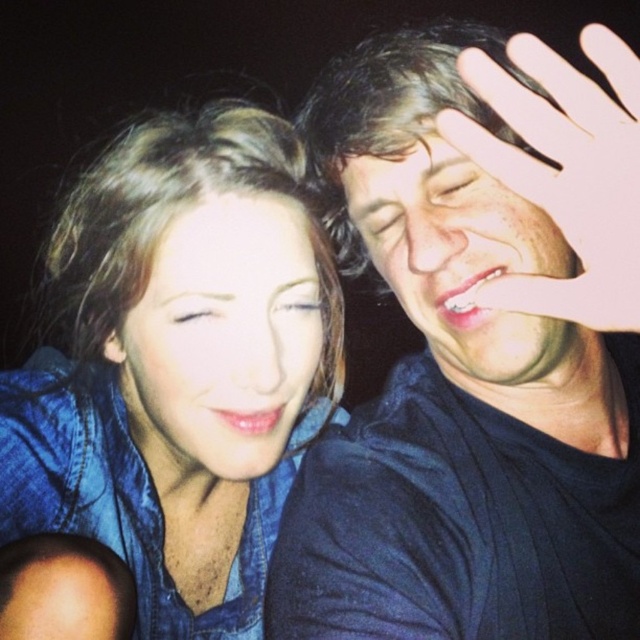
Locate an element on the screen. This screenshot has width=640, height=640. matte black shirt at right is located at coordinates (481, 355).

Is point (525, 54) in front of point (282, 308)?

Yes, point (525, 54) is closer to viewer.

Describe the element at coordinates (481, 355) in the screenshot. I see `matte black shirt at right` at that location.

This screenshot has height=640, width=640. What are the coordinates of `matte black shirt at right` in the screenshot? It's located at (481, 355).

Image resolution: width=640 pixels, height=640 pixels. What do you see at coordinates (564, 172) in the screenshot? I see `pink matte hand at upper right` at bounding box center [564, 172].

What do you see at coordinates (564, 172) in the screenshot?
I see `pink matte hand at upper right` at bounding box center [564, 172].

You are a GUI agent. You are given a task and a screenshot of the screen. Output one action in this format:
    pyautogui.click(x=<x>, y=<y>)
    Task: Click on the pink matte hand at upper right
    This screenshot has width=640, height=640.
    Given the screenshot: What is the action you would take?
    pyautogui.click(x=564, y=172)

Is smooth skin face at upper right positioned before brown matte eye at center?

Yes.

Does point (472, 272) lie behind point (200, 310)?

Yes, point (472, 272) is behind point (200, 310).

Where is `smooth skin face at upper right`? The height and width of the screenshot is (640, 640). smooth skin face at upper right is located at coordinates (468, 269).